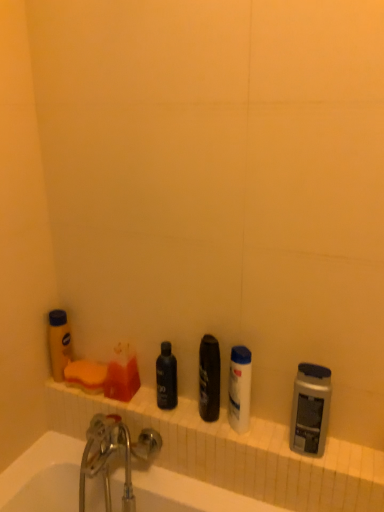
In order to click on free region on the left part of shiny black can at center, which is the 2th toiletry from right to left in this screenshot , I will do `click(161, 411)`.